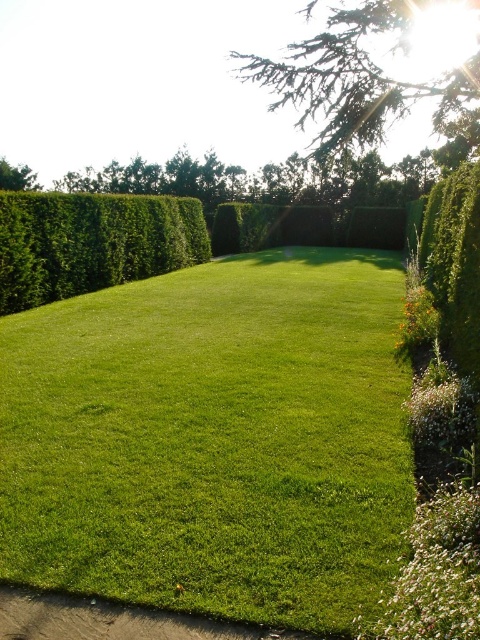
Between green grassy at center and green textured hedge at upper center, which one is positioned higher?

Positioned higher is green textured hedge at upper center.

Is green grassy at center to the left of green textured hedge at upper center from the viewer's perspective?

Yes, green grassy at center is to the left of green textured hedge at upper center.

Between point (239, 451) and point (391, 97), which one is positioned behind?

Point (391, 97)

Image resolution: width=480 pixels, height=640 pixels. In order to click on green grassy at center in this screenshot , I will do `click(213, 438)`.

Between green leafy hedge at left and green leafy bush at right, which one has less height?

Standing shorter between the two is green leafy bush at right.

Who is more forward, (120, 280) or (464, 237)?

Positioned in front is point (464, 237).

Is point (96, 282) behind point (472, 330)?

That is True.

Find the location of a particular element. The width and height of the screenshot is (480, 640). green leafy hedge at left is located at coordinates (92, 243).

Is green textured hedge at upper center shorter than green leafy bush at right?

In fact, green textured hedge at upper center may be taller than green leafy bush at right.

Locate an element on the screen. green textured hedge at upper center is located at coordinates (371, 68).

The height and width of the screenshot is (640, 480). In order to click on green textured hedge at upper center in this screenshot , I will do `click(371, 68)`.